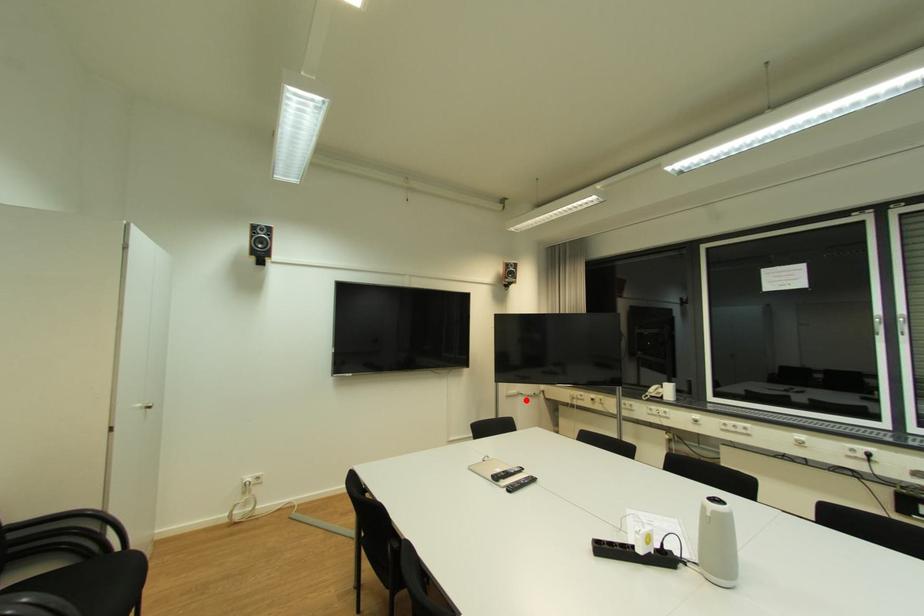
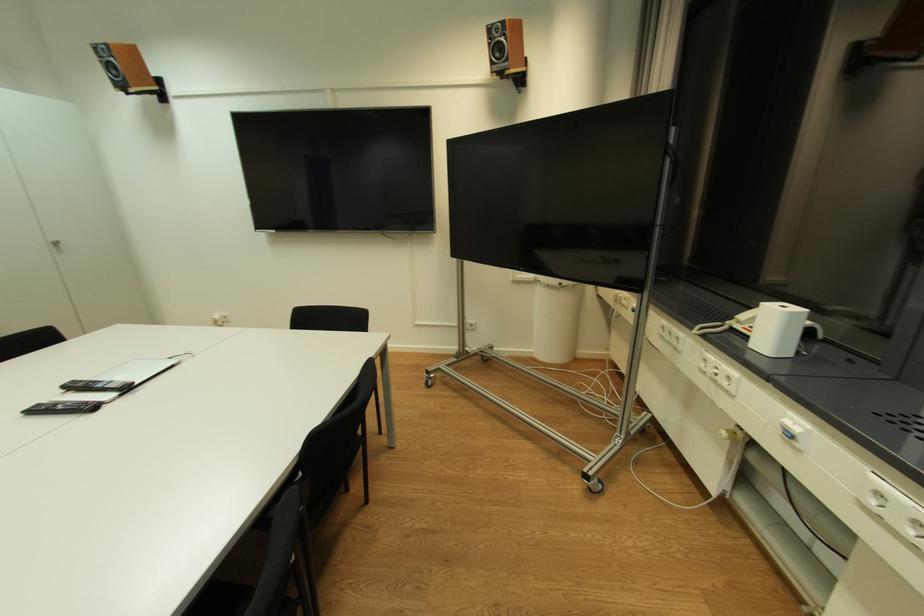
The point at the highlighted location is marked in the first image. Where is the corresponding point in the second image?

(544, 290)